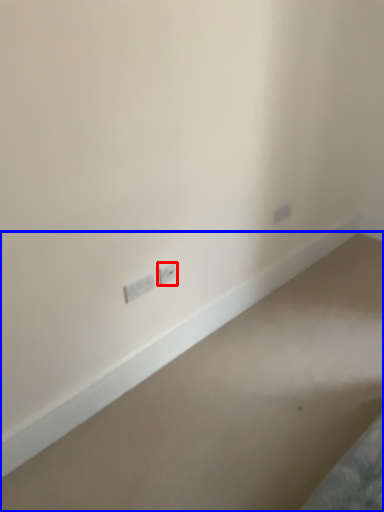
Question: Which of the following is the closest to the observer, power plugs and sockets (highlighted by a red box) or concrete (highlighted by a blue box)?

Choices:
 (A) power plugs and sockets
 (B) concrete

Answer: (B)